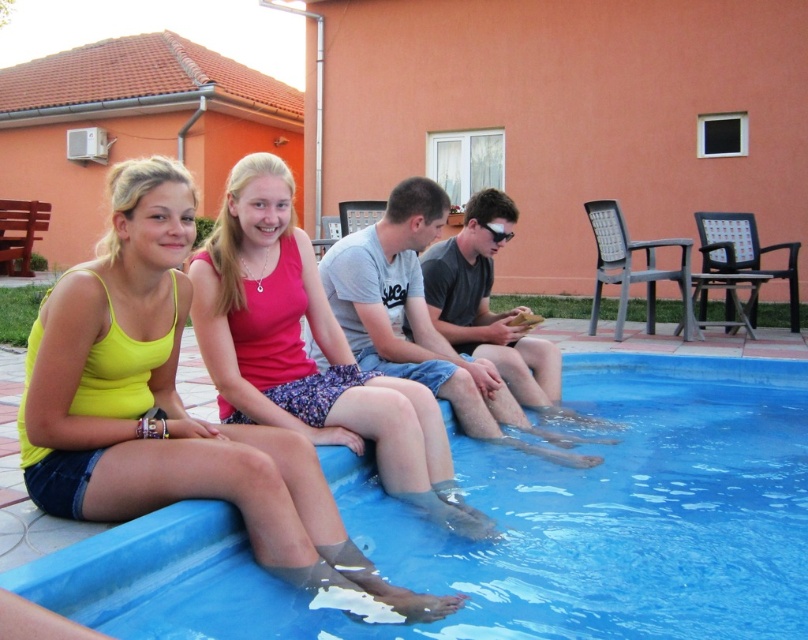
Locate an element on the screen. The width and height of the screenshot is (808, 640). yellow matte tank top at upper left is located at coordinates (167, 404).

Which is below, yellow matte tank top at upper left or transparent plastic goggles at center?

yellow matte tank top at upper left

Describe the element at coordinates (167, 404) in the screenshot. I see `yellow matte tank top at upper left` at that location.

The width and height of the screenshot is (808, 640). I want to click on yellow matte tank top at upper left, so click(x=167, y=404).

Looking at this image, who is positioned more to the right, pink fabric dress at center or transparent plastic goggles at center?

transparent plastic goggles at center is more to the right.

Between point (326, 397) and point (487, 225), which one is positioned behind?

Positioned behind is point (487, 225).

You are a GUI agent. You are given a task and a screenshot of the screen. Output one action in this format:
    pyautogui.click(x=<x>, y=<y>)
    Task: Click on the pink fabric dress at center
    This screenshot has height=640, width=808.
    Given the screenshot: What is the action you would take?
    pyautogui.click(x=305, y=352)

Which is more to the left, yellow matte tank top at upper left or pink fabric dress at center?

yellow matte tank top at upper left is more to the left.

Which is below, yellow matte tank top at upper left or pink fabric dress at center?

yellow matte tank top at upper left is below.

Who is more forward, [190,244] or [203,253]?

Point [190,244]

Where is `yellow matte tank top at upper left`? yellow matte tank top at upper left is located at coordinates (167, 404).